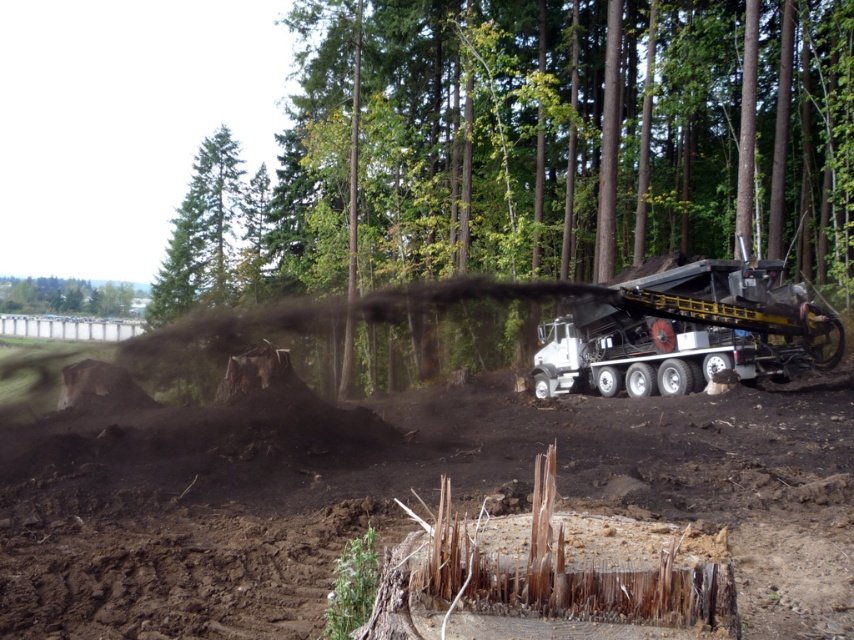
You are a forester using a drone to survey the deforested area. Your task is to locate the smooth bark tree stump at center. According to the coordinates provided, where exactly should you direct the drone to find it?

The smooth bark tree stump at center is located at coordinates point (535, 147).

You are a conservationist assessing the deforestation site. You notice the metallic gray truck at right and the green leafy tree at upper left. Which object is smaller in size?

The metallic gray truck at right has a smaller size compared to the green leafy tree at upper left, so the truck is smaller.

You are a drone operator trying to capture aerial footage of the deforestation area. You need to fly your drone from point A at point (303, 202) to point B at point (100, 545). Based on the scene, will the drone have to ascend or descend to move from point A to point B?

The drone will have to descend to move from point A at point (303, 202) to point B at point (100, 545) because point A is further to the viewer than point B, indicating it is closer in the scene, so moving to point B requires going deeper into the frame which typically corresponds to descending in altitude.